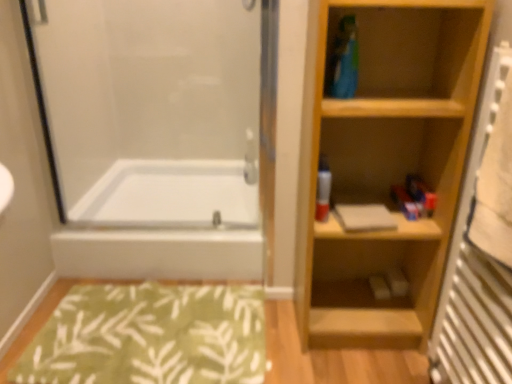
Question: From the image's perspective, relative to white glossy bathtub at lower left, is wooden radiator at right above or below?

Choices:
 (A) below
 (B) above

Answer: (A)

Question: Considering their positions, is wooden radiator at right located in front of or behind white glossy bathtub at lower left?

Choices:
 (A) front
 (B) behind

Answer: (A)

Question: Which object is the closest to the matte gray book at center?

Choices:
 (A) white glossy bathtub at lower left
 (B) light wood bookshelf at right
 (C) wooden radiator at right
 (D) transparent glass screen door at left
 (E) matte plastic spray can at center

Answer: (E)

Question: Which is nearer to the matte plastic spray can at center?

Choices:
 (A) green fabric bath mat at lower left
 (B) wooden radiator at right
 (C) transparent glass screen door at left
 (D) white glossy bathtub at lower left
 (E) matte gray book at center

Answer: (E)